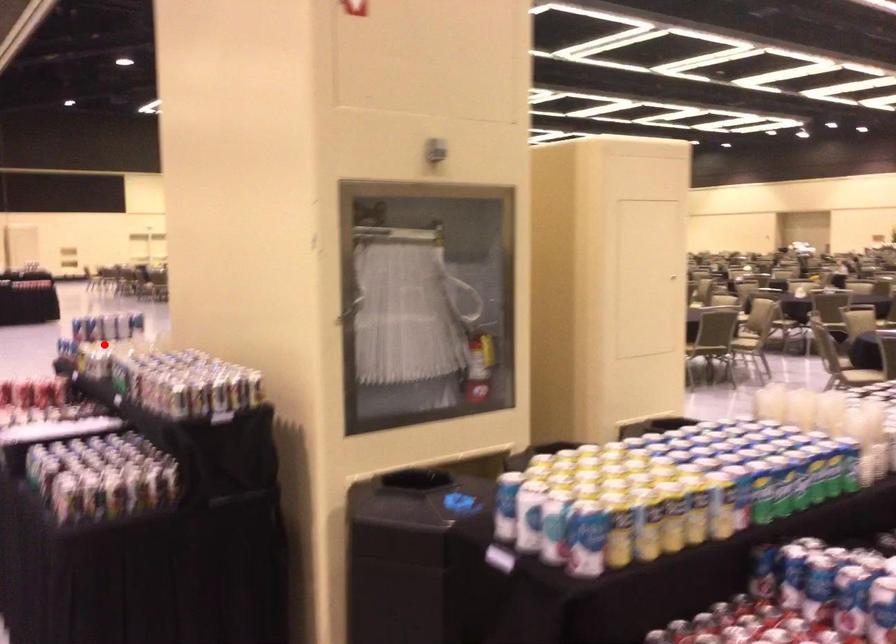
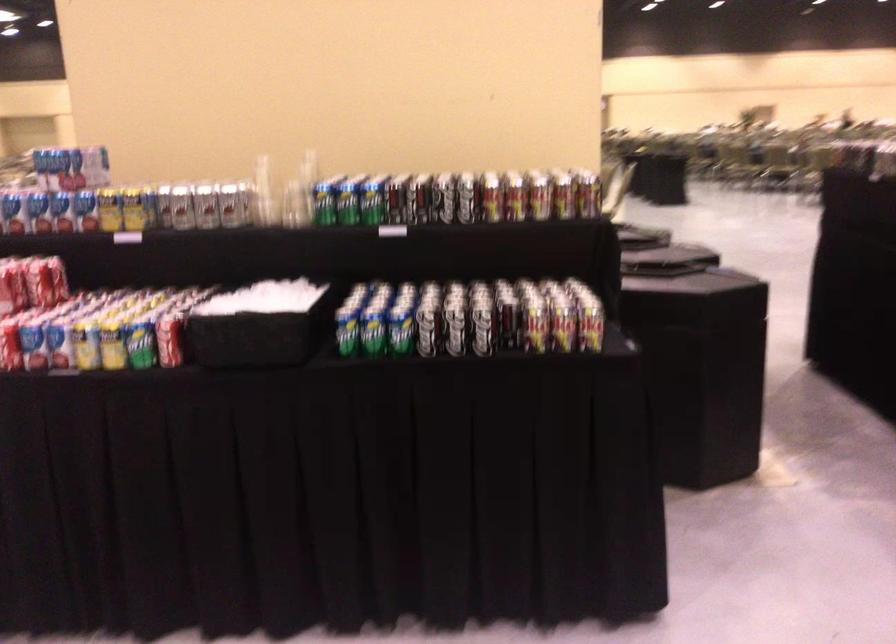
The point at the highlighted location is marked in the first image. Where is the corresponding point in the second image?

(182, 207)